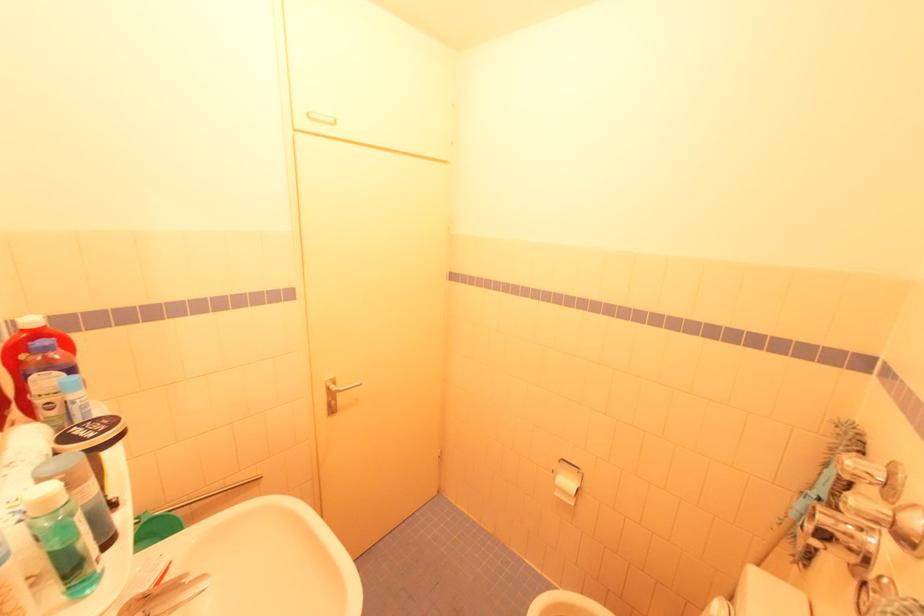
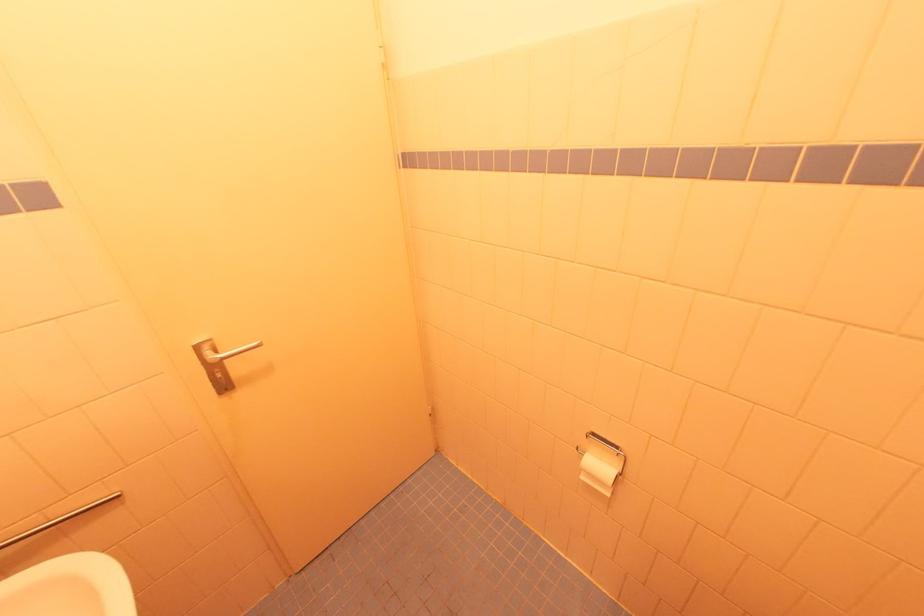
Where in the second image is the point corresponding to point 557,495 from the first image?

(585, 479)